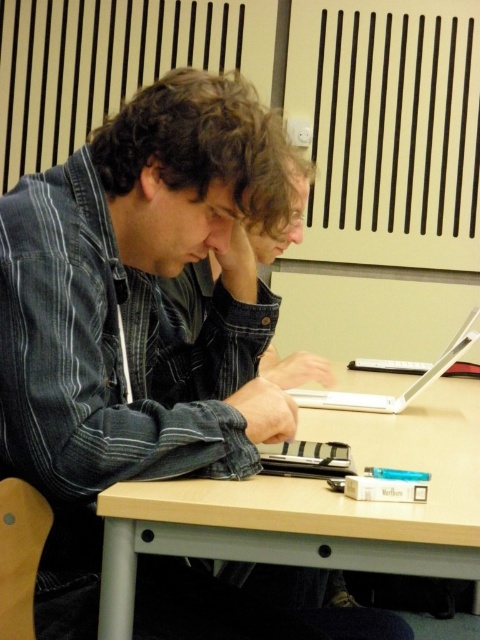
Question: Can you confirm if light brown wood table at center is smaller than white plastic laptop at center?

Choices:
 (A) no
 (B) yes

Answer: (A)

Question: Can you confirm if light brown wood table at center is thinner than white plastic laptop at center?

Choices:
 (A) no
 (B) yes

Answer: (A)

Question: Which point is farther from the camera taking this photo?

Choices:
 (A) (x=470, y=483)
 (B) (x=436, y=364)

Answer: (B)

Question: Is light brown wood table at center further to the viewer compared to white plastic laptop at center?

Choices:
 (A) yes
 (B) no

Answer: (B)